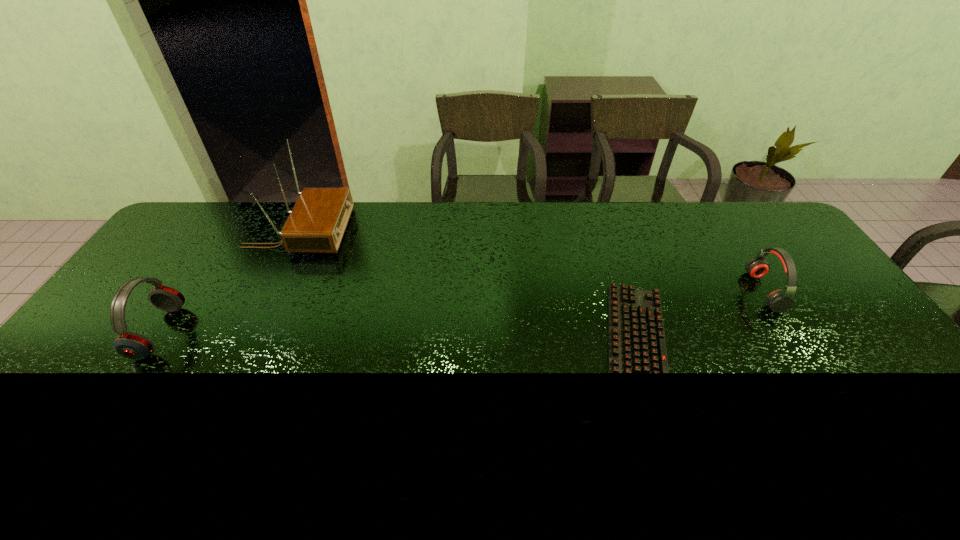
This screenshot has width=960, height=540. Identify the location of object that stands as the third closest to the rightmost object. pos(131,345).

This screenshot has width=960, height=540. In order to click on object that is the third closest to the radio_receiver in this screenshot , I will do click(x=779, y=301).

This screenshot has height=540, width=960. Identify the location of free spot that satisfies the following two spatial constraints: 1. on the front panel of the tallest object; 2. on the right side of the computer keyboard. [244, 346].

You are a GUI agent. You are given a task and a screenshot of the screen. Output one action in this format:
    pyautogui.click(x=<x>, y=<y>)
    Task: Click on the free space that satisfies the following two spatial constraints: 1. on the ear cups of the taller earphone; 2. on the left side of the shortest object
    
    Given the screenshot: What is the action you would take?
    pyautogui.click(x=151, y=346)

You are a GUI agent. You are given a task and a screenshot of the screen. Output one action in this format:
    pyautogui.click(x=<x>, y=<y>)
    Task: Click on the vacant space that satisfies the following two spatial constraints: 1. on the ear cups of the leftmost object; 2. on the back side of the second object from right to left
    
    Given the screenshot: What is the action you would take?
    pyautogui.click(x=151, y=346)

This screenshot has height=540, width=960. What are the coordinates of `free point that satisfies the following two spatial constraints: 1. on the ear cups of the leftmost object; 2. on the right side of the second object from right to left` in the screenshot? It's located at (151, 346).

The image size is (960, 540). I want to click on free space that satisfies the following two spatial constraints: 1. on the front panel of the third object from left to right; 2. on the right side of the radio_receiver, so click(244, 346).

Locate an element on the screen. The height and width of the screenshot is (540, 960). vacant space that satisfies the following two spatial constraints: 1. on the back side of the computer keyboard; 2. on the front panel of the radio_receiver is located at coordinates (601, 232).